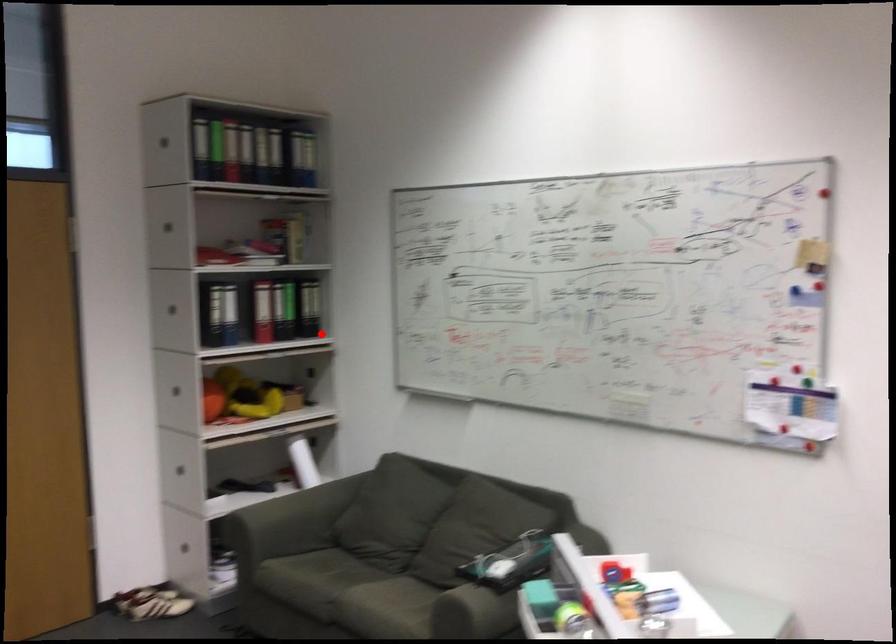
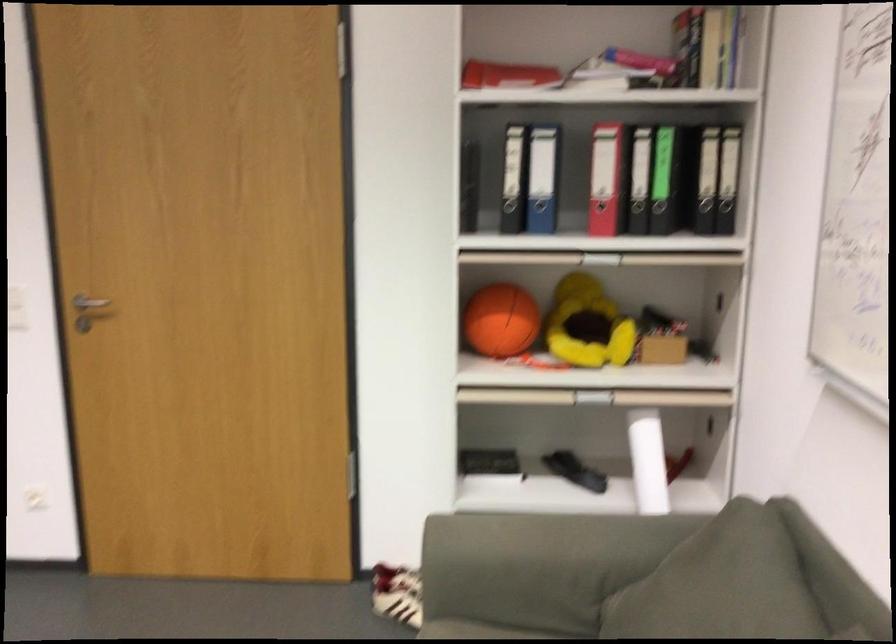
Question: I am providing you with two images of the same scene from different viewpoints. Given a red point in image1, look at the same physical point in image2. Is it:

Choices:
 (A) Closer to the viewpoint
 (B) Farther from the viewpoint

Answer: (A)